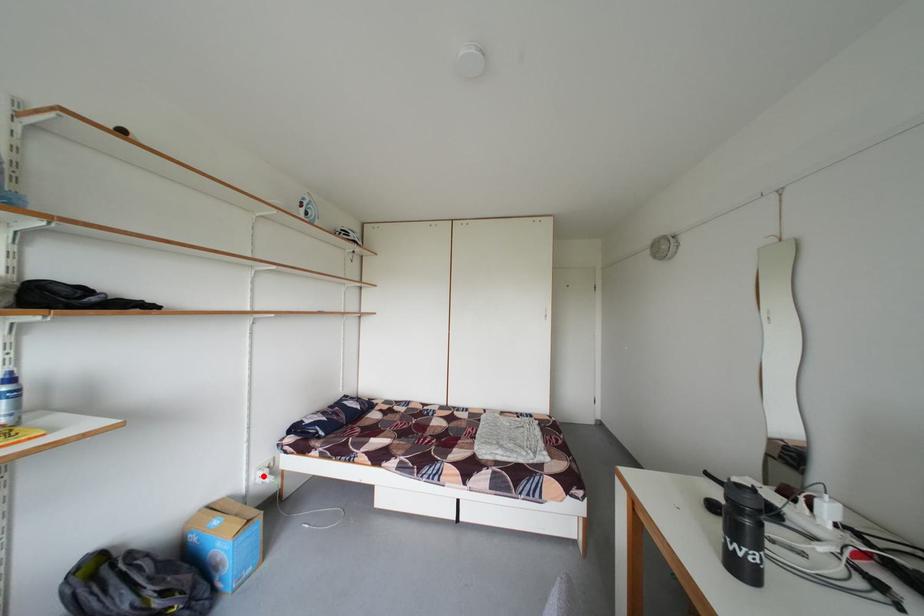
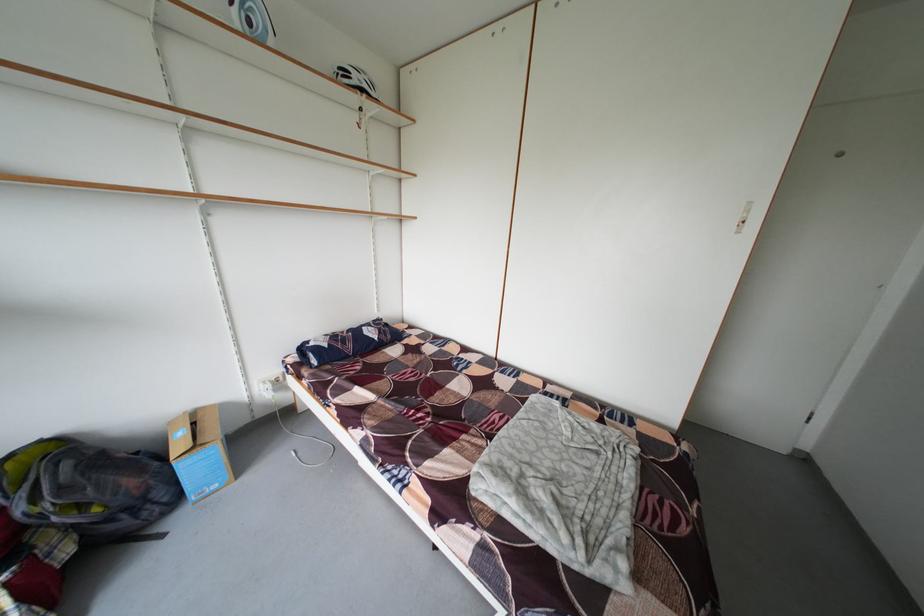
Where in the second image is the point corresponding to the highlighted location from the first image?

(265, 387)